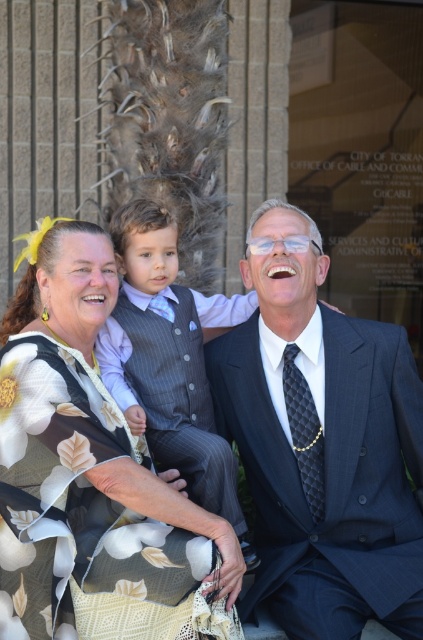
Question: Which point appears farthest from the camera in this image?

Choices:
 (A) (167, 344)
 (B) (206, 416)
 (C) (159, 496)

Answer: (B)

Question: Is gray pinstripe vest at center bigger than dark blue textured suit at center?

Choices:
 (A) yes
 (B) no

Answer: (A)

Question: Observing the image, what is the correct spatial positioning of floral fabric dress at center in reference to gray pinstripe vest at center?

Choices:
 (A) below
 (B) above

Answer: (A)

Question: Among these objects, which one is farthest from the camera?

Choices:
 (A) dark blue textured suit at center
 (B) dark blue pinstripe suit at center
 (C) gray pinstripe vest at center

Answer: (A)

Question: From the image, what is the correct spatial relationship of gray pinstripe vest at center in relation to dark blue textured suit at center?

Choices:
 (A) below
 (B) above

Answer: (B)

Question: Considering the real-world distances, which object is farthest from the dark blue textured suit at center?

Choices:
 (A) floral fabric dress at center
 (B) gray pinstripe vest at center
 (C) dark blue pinstripe suit at center

Answer: (C)